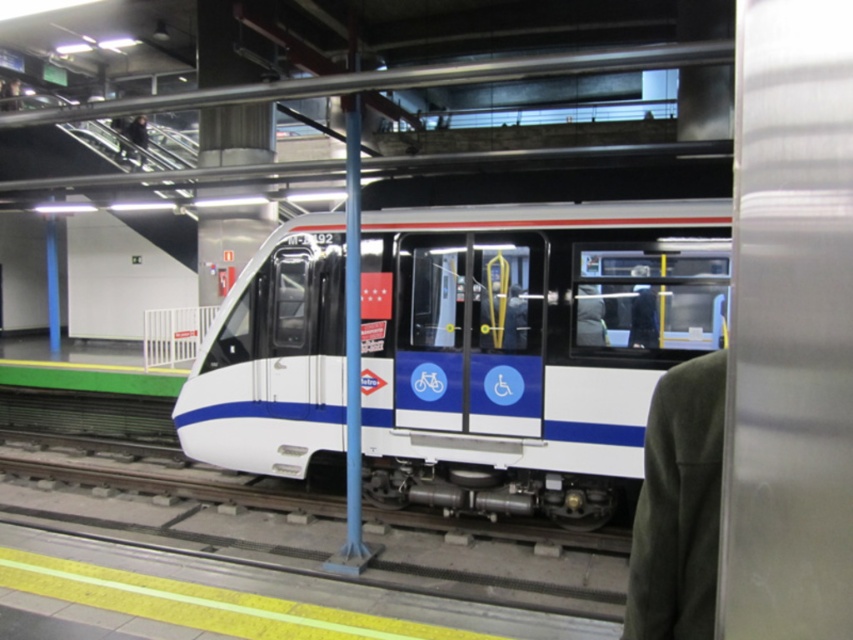
Question: Among these objects, which one is farthest from the camera?

Choices:
 (A) green wool coat at right
 (B) dark gray suit at center
 (C) white glossy train at center

Answer: (B)

Question: Is green wool coat at right bigger than dark gray suit at center?

Choices:
 (A) no
 (B) yes

Answer: (B)

Question: Is green wool coat at right positioned in front of dark gray suit at center?

Choices:
 (A) yes
 (B) no

Answer: (A)

Question: Which point is closer to the camera taking this photo?

Choices:
 (A) (643, 289)
 (B) (320, 282)

Answer: (A)

Question: Observing the image, what is the correct spatial positioning of white glossy train at center in reference to dark gray suit at center?

Choices:
 (A) left
 (B) right

Answer: (A)

Question: Which point is farther from the camera taking this photo?

Choices:
 (A) (703, 356)
 (B) (636, 296)

Answer: (B)